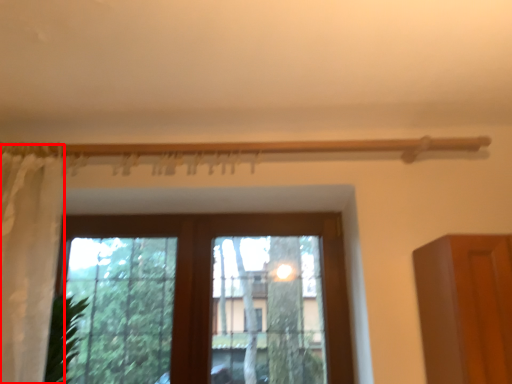
Question: From the image's perspective, what is the correct spatial positioning of curtain (annotated by the red box) in reference to window?

Choices:
 (A) above
 (B) below

Answer: (A)